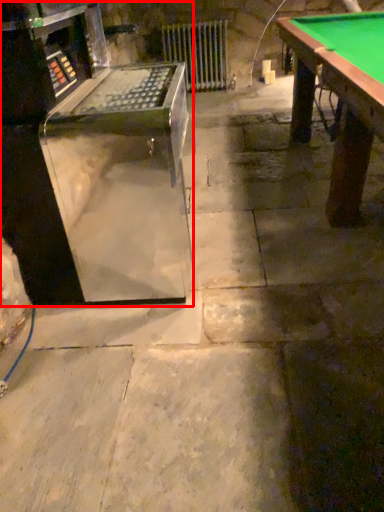
Question: From the image's perspective, where is equipment (annotated by the red box) located in relation to radiator in the image?

Choices:
 (A) above
 (B) below

Answer: (B)